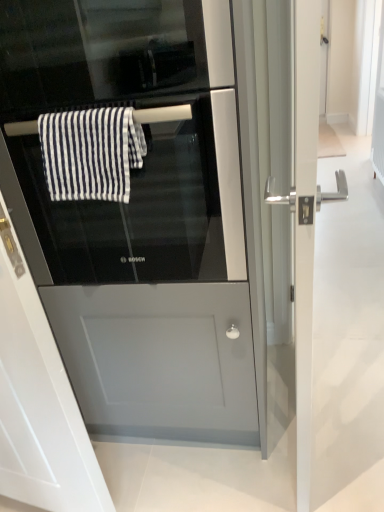
Find the location of a particular element. The width and height of the screenshot is (384, 512). vacant space underneath silver metallic door handle at right, marked as the 2th screen door in a left-to-right arrangement (from a real-world perspective) is located at coordinates (318, 419).